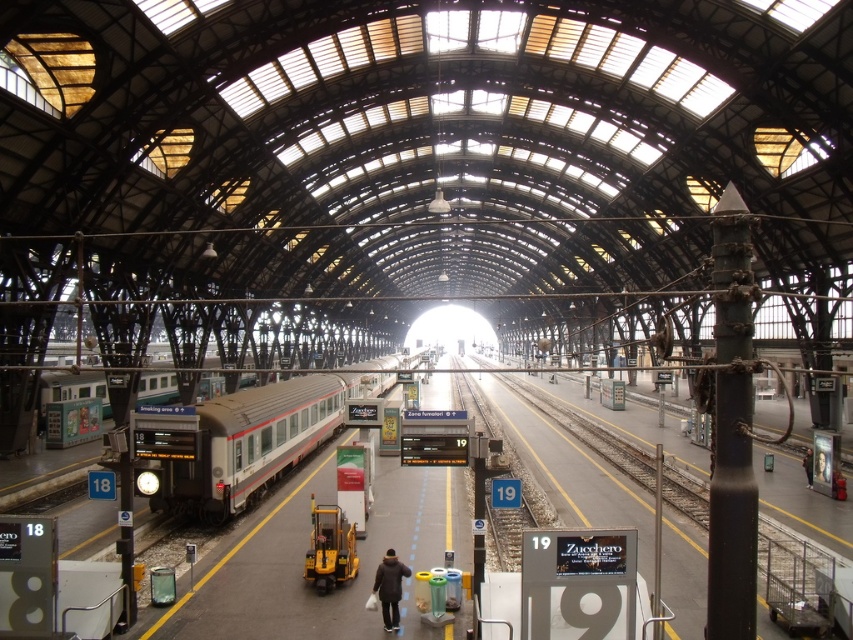
Is dark brown leather jacket at center bigger than black leather jacket at center?

Incorrect, dark brown leather jacket at center is not larger than black leather jacket at center.

Can you confirm if dark brown leather jacket at center is smaller than black leather jacket at center?

Yes.

Find the location of a particular element. This screenshot has width=853, height=640. dark brown leather jacket at center is located at coordinates coord(389,588).

Does silver metallic train at left have a lesser height compared to dark brown leather jacket at center?

No, silver metallic train at left is not shorter than dark brown leather jacket at center.

Does point (251, 412) come in front of point (386, 608)?

No, it is not.

The height and width of the screenshot is (640, 853). Describe the element at coordinates (242, 438) in the screenshot. I see `silver metallic train at left` at that location.

Locate an element on the screen. This screenshot has width=853, height=640. silver metallic train at left is located at coordinates (242, 438).

Measure the distance from silver metallic train at left to black leather jacket at center.

They are 103.31 feet apart.

Between silver metallic train at left and black leather jacket at center, which one appears on the left side from the viewer's perspective?

silver metallic train at left

Is point (222, 456) closer to viewer compared to point (811, 454)?

Yes, point (222, 456) is in front of point (811, 454).

Identify the location of silver metallic train at left. The height and width of the screenshot is (640, 853). (242, 438).